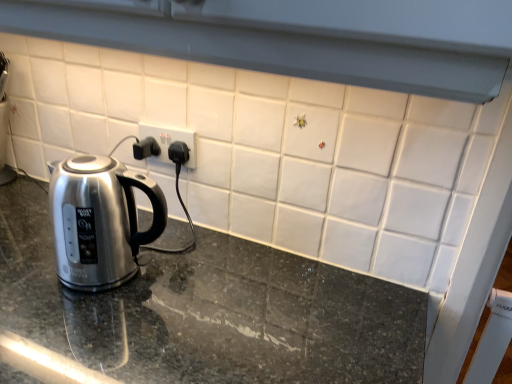
Question: Considering the positions of granite countertop at center and white plastic electric outlet at center in the image, is granite countertop at center bigger or smaller than white plastic electric outlet at center?

Choices:
 (A) small
 (B) big

Answer: (B)

Question: Considering the positions of point (24, 225) and point (146, 129), is point (24, 225) closer or farther from the camera than point (146, 129)?

Choices:
 (A) closer
 (B) farther

Answer: (A)

Question: Considering the real-world distances, which object is farthest from the granite countertop at center?

Choices:
 (A) white plastic electric outlet at center
 (B) satin metallic kettle at left

Answer: (A)

Question: Based on their relative distances, which object is nearer to the granite countertop at center?

Choices:
 (A) white plastic electric outlet at center
 (B) satin metallic kettle at left

Answer: (B)